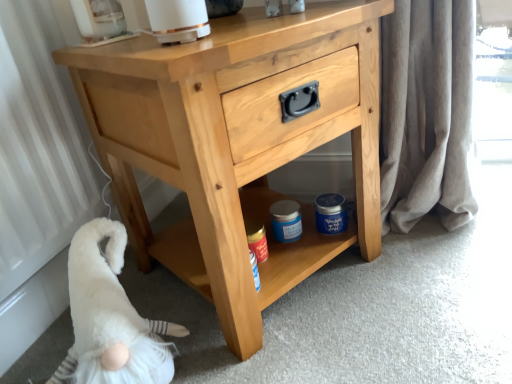
At what (x,y) coordinates should I click in order to perform the action: click on unoccupied space behind white fluffy gnome at lower left. Please return your answer as a coordinate pair (x, y). The width and height of the screenshot is (512, 384). Looking at the image, I should click on (163, 297).